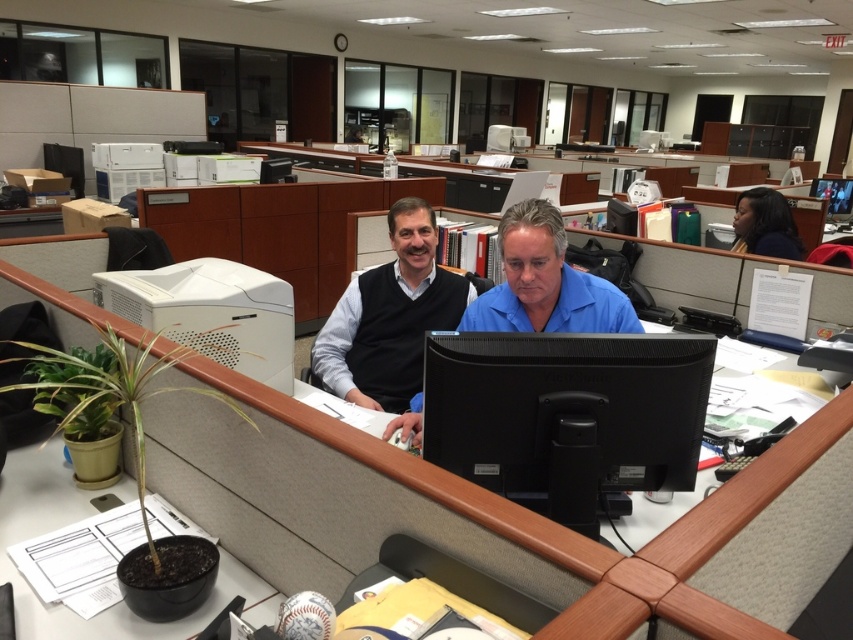
Question: Does matte black sweater at center appear over blue matte shirt at center?

Choices:
 (A) yes
 (B) no

Answer: (A)

Question: Considering the relative positions of matte black sweater at center and white matte desktop computer at upper left in the image provided, where is matte black sweater at center located with respect to white matte desktop computer at upper left?

Choices:
 (A) right
 (B) left

Answer: (A)

Question: Estimate the real-world distances between objects in this image. Which object is farther from the blue matte shirt at center?

Choices:
 (A) matte black sweater at center
 (B) white matte desktop computer at upper left
 (C) black glossy monitor at center

Answer: (B)

Question: Which object is farther from the camera taking this photo?

Choices:
 (A) white matte desktop computer at upper left
 (B) black glossy monitor at center
 (C) black glossy computer monitor at upper right

Answer: (C)

Question: Considering the real-world distances, which object is farthest from the matte black sweater at center?

Choices:
 (A) white matte desktop computer at upper left
 (B) black glossy monitor at center
 (C) black glossy computer monitor at upper right
 (D) blue matte shirt at center

Answer: (C)

Question: Does black glossy monitor at center lie behind white matte desktop computer at upper left?

Choices:
 (A) yes
 (B) no

Answer: (B)